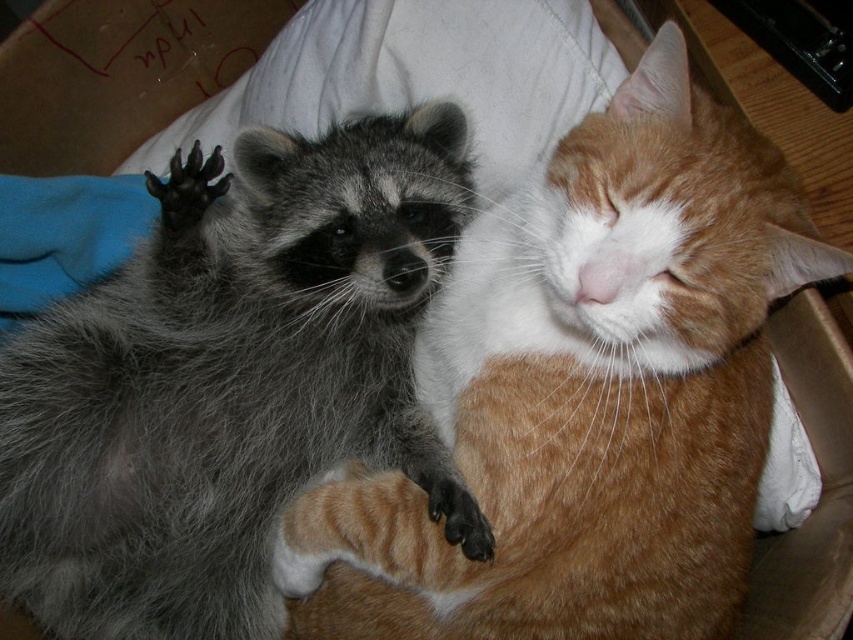
Question: Is orange tabby cat at center bigger than gray fur raccoon at upper left?

Choices:
 (A) yes
 (B) no

Answer: (A)

Question: Which point is farther to the camera?

Choices:
 (A) (80, 502)
 (B) (440, 428)

Answer: (B)

Question: Which of the following is the closest to the observer?

Choices:
 (A) gray fur raccoon at upper left
 (B) orange tabby cat at center

Answer: (B)

Question: Can you confirm if orange tabby cat at center is positioned to the left of gray fur raccoon at upper left?

Choices:
 (A) yes
 (B) no

Answer: (B)

Question: Can you confirm if orange tabby cat at center is positioned above gray fur raccoon at upper left?

Choices:
 (A) yes
 (B) no

Answer: (B)